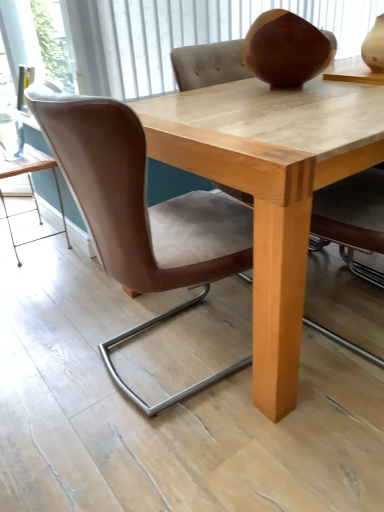
This screenshot has height=512, width=384. In order to click on free space in front of brown leather chair at center in this screenshot , I will do `click(188, 456)`.